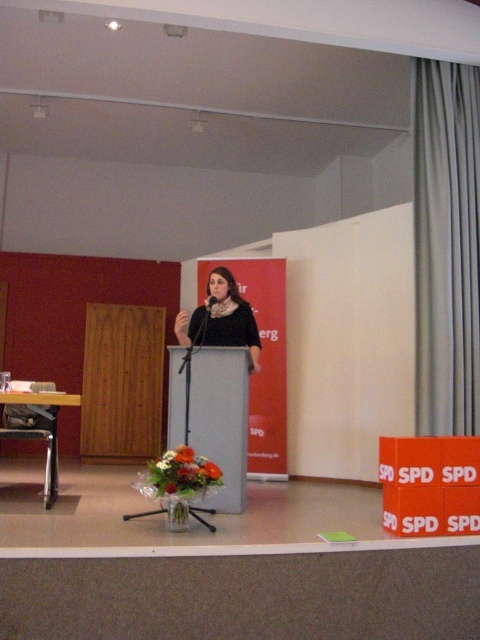
Question: Is matte gray podium at center bigger than black fabric scarf at center?

Choices:
 (A) no
 (B) yes

Answer: (A)

Question: Based on their relative distances, which object is farther from the black matte microphone at center?

Choices:
 (A) black fabric scarf at center
 (B) matte gray podium at center

Answer: (B)

Question: Which object is positioned closest to the matte gray podium at center?

Choices:
 (A) black matte microphone at center
 (B) black fabric scarf at center

Answer: (B)

Question: Can you confirm if matte gray podium at center is positioned to the left of black matte microphone at center?

Choices:
 (A) no
 (B) yes

Answer: (A)

Question: Which object is closer to the camera taking this photo?

Choices:
 (A) black matte microphone at center
 (B) matte gray podium at center

Answer: (B)

Question: Does matte gray podium at center have a lesser width compared to black matte microphone at center?

Choices:
 (A) no
 (B) yes

Answer: (A)